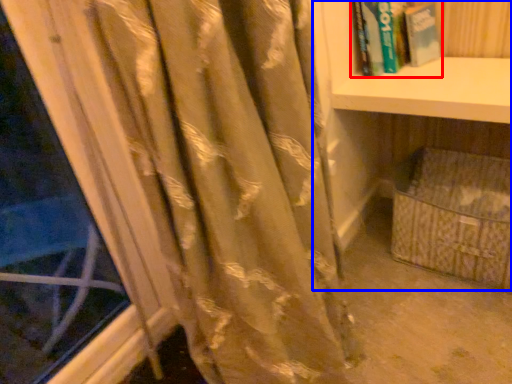
Question: Which point is further to the camera, book (highlighted by a red box) or bookcase (highlighted by a blue box)?

Choices:
 (A) book
 (B) bookcase

Answer: (A)